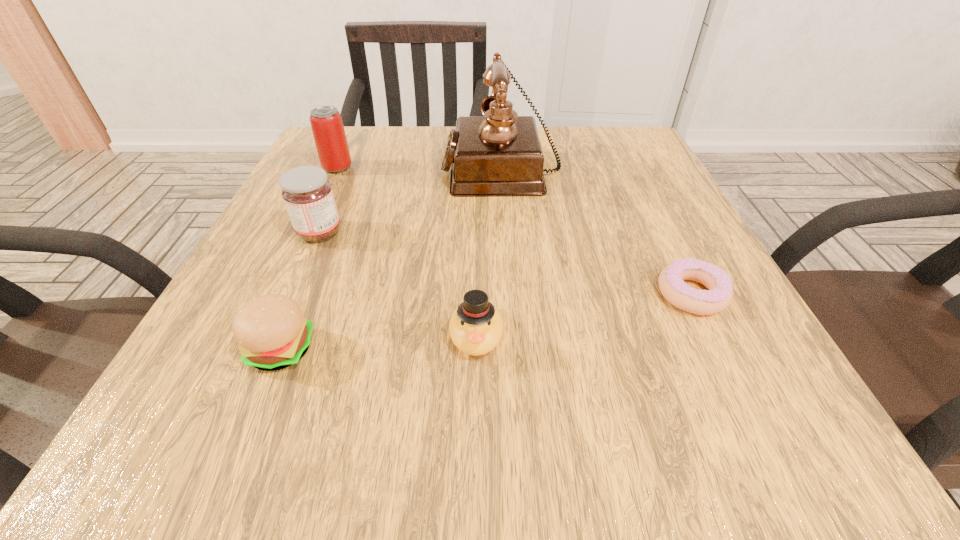
At what (x,y) coordinates should I click in order to perform the action: click on vacant position in the image that satisfies the following two spatial constraints: 1. on the front side of the beer can; 2. on the right side of the jam. Please return your answer as a coordinate pair (x, y). Looking at the image, I should click on point(306,233).